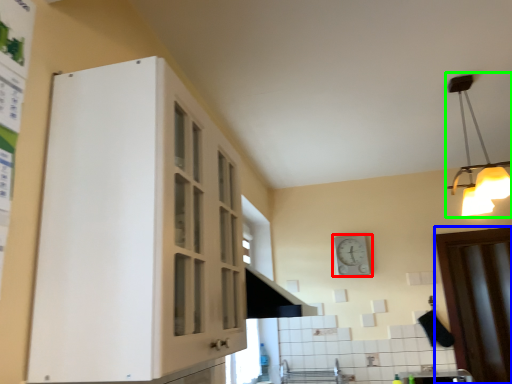
Question: Which object is positioned closest to clock (highlighted by a red box)? Select from door (highlighted by a blue box) and light fixture (highlighted by a green box).

Choices:
 (A) door
 (B) light fixture

Answer: (A)